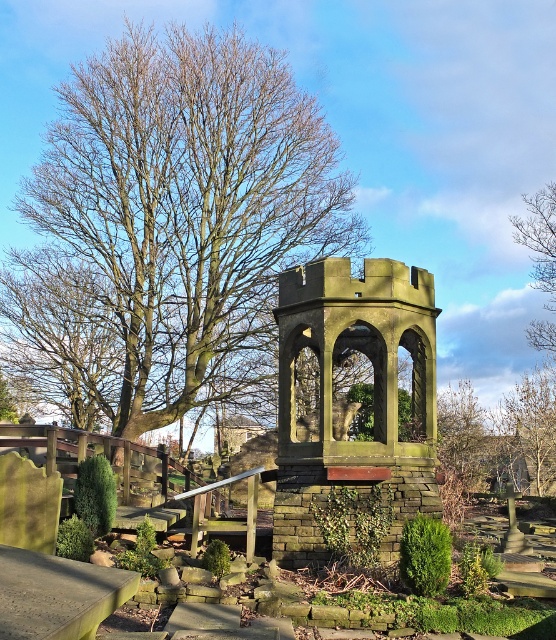
In the scene shown: Who is lower down, green leafy hedge at center or green leafy hedge at lower left?

Positioned lower is green leafy hedge at lower left.

Is green leafy hedge at center wider than green leafy hedge at lower left?

Yes.

Between point (92, 515) and point (81, 557), which one is positioned behind?

Positioned behind is point (92, 515).

This screenshot has width=556, height=640. In order to click on green leafy hedge at center in this screenshot , I will do click(96, 493).

Between point (399, 273) and point (528, 218), which one is positioned behind?

The point (528, 218) is behind.

Can you confirm if green stone gazebo at center is bigger than bare branches at upper right?

No, green stone gazebo at center is not bigger than bare branches at upper right.

Describe the element at coordinates (374, 396) in the screenshot. The width and height of the screenshot is (556, 640). I see `green stone gazebo at center` at that location.

The image size is (556, 640). I want to click on green stone gazebo at center, so click(x=374, y=396).

How much distance is there between green stone gazebo at center and green leafy hedge at lower center?

green stone gazebo at center and green leafy hedge at lower center are 10.45 feet apart.

Consider the image. Between green stone gazebo at center and green leafy hedge at lower center, which one appears on the right side from the viewer's perspective?

From the viewer's perspective, green leafy hedge at lower center appears more on the right side.

Between point (419, 481) and point (444, 540), which one is positioned behind?

Point (419, 481)

Image resolution: width=556 pixels, height=640 pixels. I want to click on green stone gazebo at center, so click(x=374, y=396).